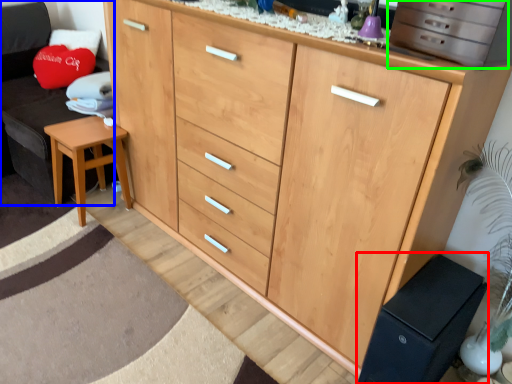
Question: Estimate the real-world distances between objects in this image. Which object is closer to changing table (highlighted by a red box), swivel chair (highlighted by a blue box) or cabinetry (highlighted by a green box)?

Choices:
 (A) swivel chair
 (B) cabinetry

Answer: (B)